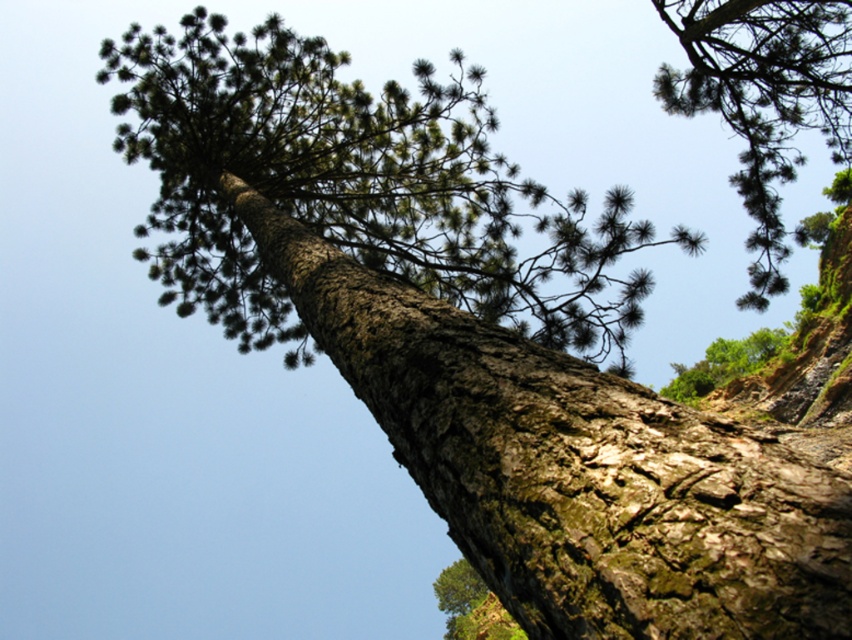
Question: Does green rough bark tree at upper right have a larger size compared to green rough bark tree at center?

Choices:
 (A) yes
 (B) no

Answer: (B)

Question: Among these points, which one is farthest from the camera?

Choices:
 (A) (452, 586)
 (B) (738, 134)
 (C) (479, 499)

Answer: (A)

Question: Which point is farther to the camera?

Choices:
 (A) (816, 470)
 (B) (775, 193)

Answer: (B)

Question: Is greenish-brown bark tree trunk at center above green rough bark tree at center?

Choices:
 (A) yes
 (B) no

Answer: (A)

Question: Among these points, which one is farthest from the camera?

Choices:
 (A) (375, 292)
 (B) (764, 244)
 (C) (464, 632)

Answer: (C)

Question: Does greenish-brown bark tree trunk at center have a lesser width compared to green rough bark tree at upper right?

Choices:
 (A) yes
 (B) no

Answer: (A)